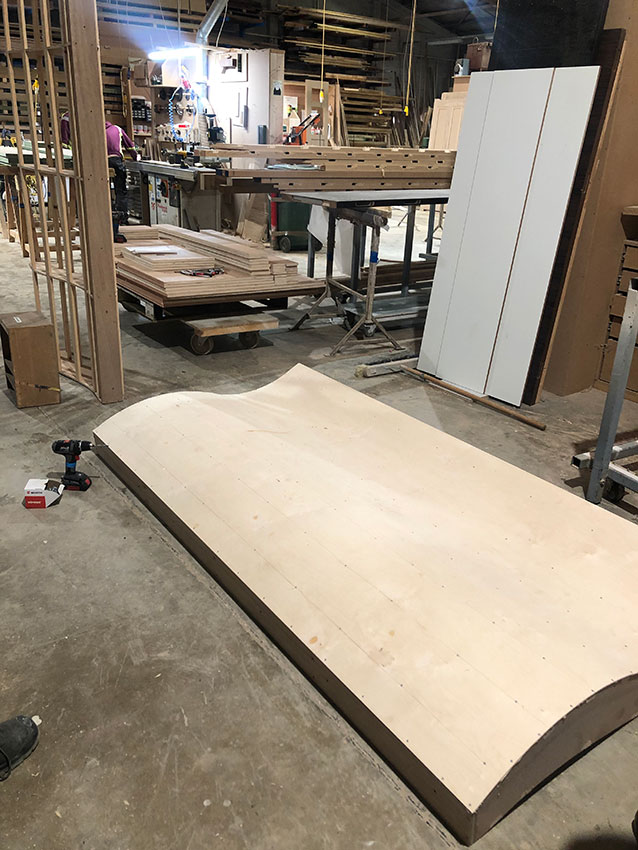
You are a GUI agent. You are given a task and a screenshot of the screen. Output one action in this format:
    pyautogui.click(x=<x>, y=<y>)
    Task: Click on the dust on floor
    Image resolution: width=638 pixels, height=850 pixels.
    Given the screenshot: What is the action you would take?
    pyautogui.click(x=80, y=570)